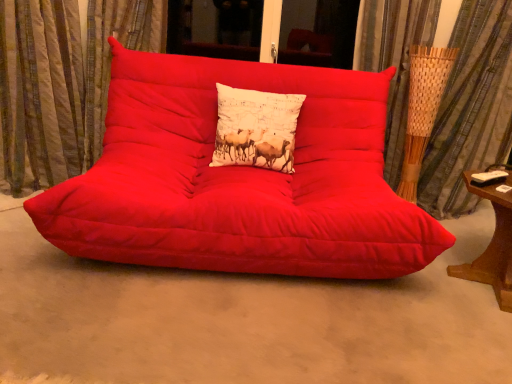
Image resolution: width=512 pixels, height=384 pixels. In order to click on free space that is to the left of wooden side table at right in this screenshot , I will do `click(408, 292)`.